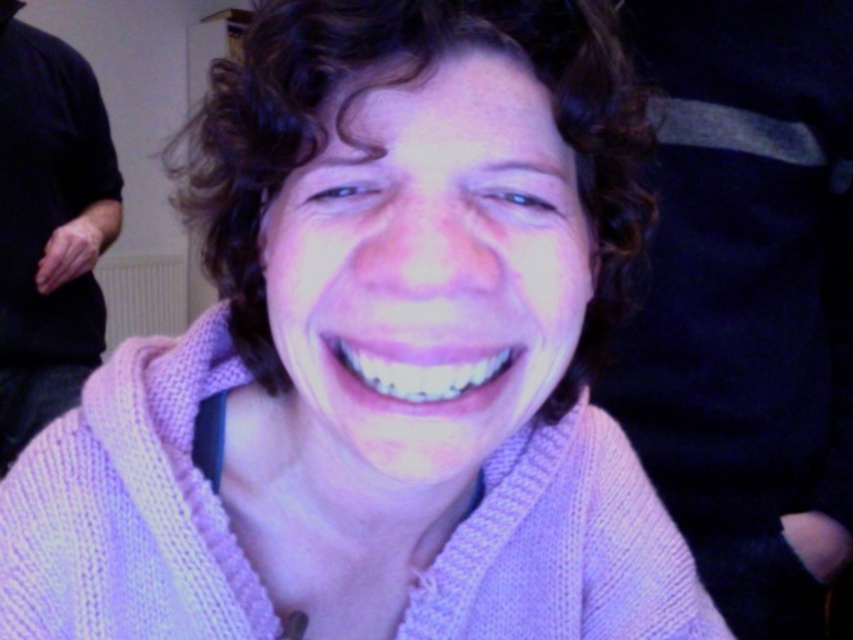
Where is `curly brown hair at center`? This screenshot has width=853, height=640. curly brown hair at center is located at coordinates (381, 152).

The width and height of the screenshot is (853, 640). Describe the element at coordinates (381, 152) in the screenshot. I see `curly brown hair at center` at that location.

Identify the location of curly brown hair at center. (381, 152).